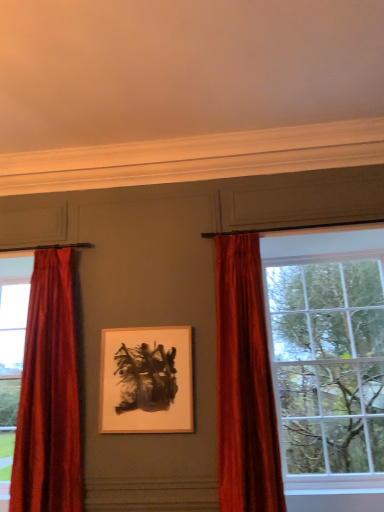
What do you see at coordinates (48, 395) in the screenshot?
I see `velvet red curtain at left, arranged as the second curtain when viewed from the right` at bounding box center [48, 395].

The image size is (384, 512). Describe the element at coordinates (244, 383) in the screenshot. I see `velvet red curtain at right, which is the first curtain in right-to-left order` at that location.

The width and height of the screenshot is (384, 512). What do you see at coordinates (327, 356) in the screenshot? I see `matte glass window at right` at bounding box center [327, 356].

I want to click on velvet red curtain at left, arranged as the second curtain when viewed from the right, so click(x=48, y=395).

In terms of width, does matte glass window at right look wider or thinner when compared to matte white picture frame at center?

Clearly, matte glass window at right has more width compared to matte white picture frame at center.

Is matte glass window at right far away from matte white picture frame at center?

Yes, matte glass window at right and matte white picture frame at center are quite far apart.

Can we say matte glass window at right lies outside matte white picture frame at center?

matte glass window at right lies outside matte white picture frame at center's area.

Is matte glass window at right thinner than velvet red curtain at right, placed as the 2th curtain when sorted from left to right?

No, matte glass window at right is not thinner than velvet red curtain at right, placed as the 2th curtain when sorted from left to right.

Who is shorter, matte glass window at right or velvet red curtain at right, which is the first curtain in right-to-left order?

With less height is velvet red curtain at right, which is the first curtain in right-to-left order.

Consider the image. Would you consider matte glass window at right to be distant from velvet red curtain at right, which is the first curtain in right-to-left order?

No, matte glass window at right is not far from velvet red curtain at right, which is the first curtain in right-to-left order.

From a real-world perspective, is matte glass window at right located beneath velvet red curtain at right, placed as the 2th curtain when sorted from left to right?

Yes, from a real-world perspective, matte glass window at right is under velvet red curtain at right, placed as the 2th curtain when sorted from left to right.

Does velvet red curtain at left, arranged as the second curtain when viewed from the right, appear on the right side of matte white picture frame at center?

No.

Is velvet red curtain at left, arranged as the second curtain when viewed from the right, positioned with its back to matte white picture frame at center?

That's not correct — velvet red curtain at left, arranged as the second curtain when viewed from the right, is not looking away from matte white picture frame at center.

Between velvet red curtain at left, arranged as the second curtain when viewed from the right, and matte white picture frame at center, which one has smaller size?

matte white picture frame at center is smaller.

Is velvet red curtain at left, which is the 1th curtain from left to right, placed right next to matte white picture frame at center?

No, velvet red curtain at left, which is the 1th curtain from left to right, is not in contact with matte white picture frame at center.

Would you say matte white picture frame at center is to the left or to the right of matte glass window at right in the picture?

Clearly, matte white picture frame at center is on the left of matte glass window at right in the image.

From the image's perspective, is matte white picture frame at center located above or below matte glass window at right?

From the image's perspective, matte white picture frame at center appears above matte glass window at right.

From a real-world perspective, is matte white picture frame at center located beneath matte glass window at right?

No, from a real-world perspective, matte white picture frame at center is not beneath matte glass window at right.

Does matte white picture frame at center have a lesser width compared to matte glass window at right?

Correct, the width of matte white picture frame at center is less than that of matte glass window at right.

In the scene shown: Would you say velvet red curtain at right, placed as the 2th curtain when sorted from left to right, contains velvet red curtain at left, which is the 1th curtain from left to right?

No, velvet red curtain at left, which is the 1th curtain from left to right, is not surrounded by velvet red curtain at right, placed as the 2th curtain when sorted from left to right.

Does point (267, 354) appear closer or farther from the camera than point (44, 254)?

Clearly, point (267, 354) is closer to the camera than point (44, 254).

From a real-world perspective, is velvet red curtain at right, placed as the 2th curtain when sorted from left to right, positioned under velvet red curtain at left, arranged as the second curtain when viewed from the right, based on gravity?

Indeed, from a real-world perspective, velvet red curtain at right, placed as the 2th curtain when sorted from left to right, is positioned beneath velvet red curtain at left, arranged as the second curtain when viewed from the right.

Considering the relative sizes of velvet red curtain at left, which is the 1th curtain from left to right, and velvet red curtain at right, placed as the 2th curtain when sorted from left to right, in the image provided, is velvet red curtain at left, which is the 1th curtain from left to right, bigger than velvet red curtain at right, placed as the 2th curtain when sorted from left to right,?

Yes, velvet red curtain at left, which is the 1th curtain from left to right, is bigger than velvet red curtain at right, placed as the 2th curtain when sorted from left to right.

Which object is thinner, velvet red curtain at left, arranged as the second curtain when viewed from the right, or velvet red curtain at right, which is the first curtain in right-to-left order?

Thinner between the two is velvet red curtain at right, which is the first curtain in right-to-left order.

Is velvet red curtain at left, arranged as the second curtain when viewed from the right, touching velvet red curtain at right, which is the first curtain in right-to-left order?

They are not placed beside each other.

From the picture: From the image's perspective, is velvet red curtain at right, placed as the 2th curtain when sorted from left to right, located above matte white picture frame at center?

Yes, from the image's perspective, velvet red curtain at right, placed as the 2th curtain when sorted from left to right, is above matte white picture frame at center.

The height and width of the screenshot is (512, 384). I want to click on curtain on the right of matte white picture frame at center, so click(x=244, y=383).

Can you confirm if velvet red curtain at right, placed as the 2th curtain when sorted from left to right, is shorter than matte white picture frame at center?

In fact, velvet red curtain at right, placed as the 2th curtain when sorted from left to right, may be taller than matte white picture frame at center.

Find the location of `window lying below the matte white picture frame at center (from the image's perspective)`. window lying below the matte white picture frame at center (from the image's perspective) is located at coordinates (327, 356).

Identify the location of the 1st curtain counting from the left side of the matte glass window at right. (244, 383).

Estimate the real-world distances between objects in this image. Which object is closer to matte white picture frame at center, velvet red curtain at left, arranged as the second curtain when viewed from the right, or matte glass window at right?

velvet red curtain at left, arranged as the second curtain when viewed from the right, is closer to matte white picture frame at center.

Which object lies further to the anchor point velvet red curtain at left, arranged as the second curtain when viewed from the right, matte white picture frame at center or velvet red curtain at right, which is the first curtain in right-to-left order?

velvet red curtain at right, which is the first curtain in right-to-left order, lies further to velvet red curtain at left, arranged as the second curtain when viewed from the right, than the other object.

From the image, which object appears to be farther from matte glass window at right, velvet red curtain at left, which is the 1th curtain from left to right, or matte white picture frame at center?

Based on the image, velvet red curtain at left, which is the 1th curtain from left to right, appears to be further to matte glass window at right.

Looking at the image, which one is located further to matte white picture frame at center, matte glass window at right or velvet red curtain at left, which is the 1th curtain from left to right?

The object further to matte white picture frame at center is matte glass window at right.

From the image, which object appears to be nearer to velvet red curtain at left, which is the 1th curtain from left to right, matte white picture frame at center or matte glass window at right?

Based on the image, matte white picture frame at center appears to be nearer to velvet red curtain at left, which is the 1th curtain from left to right.

Estimate the real-world distances between objects in this image. Which object is closer to matte glass window at right, matte white picture frame at center or velvet red curtain at left, which is the 1th curtain from left to right?

matte white picture frame at center.

Estimate the real-world distances between objects in this image. Which object is further from matte white picture frame at center, velvet red curtain at right, placed as the 2th curtain when sorted from left to right, or matte glass window at right?

matte glass window at right lies further to matte white picture frame at center than the other object.

Based on their spatial positions, is matte white picture frame at center or matte glass window at right further from velvet red curtain at right, which is the first curtain in right-to-left order?

matte glass window at right is further to velvet red curtain at right, which is the first curtain in right-to-left order.

The width and height of the screenshot is (384, 512). Find the location of `picture frame located between velvet red curtain at left, arranged as the second curtain when viewed from the right, and velvet red curtain at right, placed as the 2th curtain when sorted from left to right, in the left-right direction`. picture frame located between velvet red curtain at left, arranged as the second curtain when viewed from the right, and velvet red curtain at right, placed as the 2th curtain when sorted from left to right, in the left-right direction is located at coordinates (147, 380).

Where is `picture frame between velvet red curtain at left, which is the 1th curtain from left to right, and matte glass window at right from left to right`? picture frame between velvet red curtain at left, which is the 1th curtain from left to right, and matte glass window at right from left to right is located at coordinates (147, 380).

Where is `curtain located between velvet red curtain at left, arranged as the second curtain when viewed from the right, and matte glass window at right in the left-right direction`? curtain located between velvet red curtain at left, arranged as the second curtain when viewed from the right, and matte glass window at right in the left-right direction is located at coordinates (244, 383).

Locate an element on the screen. This screenshot has height=512, width=384. curtain located between matte white picture frame at center and matte glass window at right in the left-right direction is located at coordinates (244, 383).